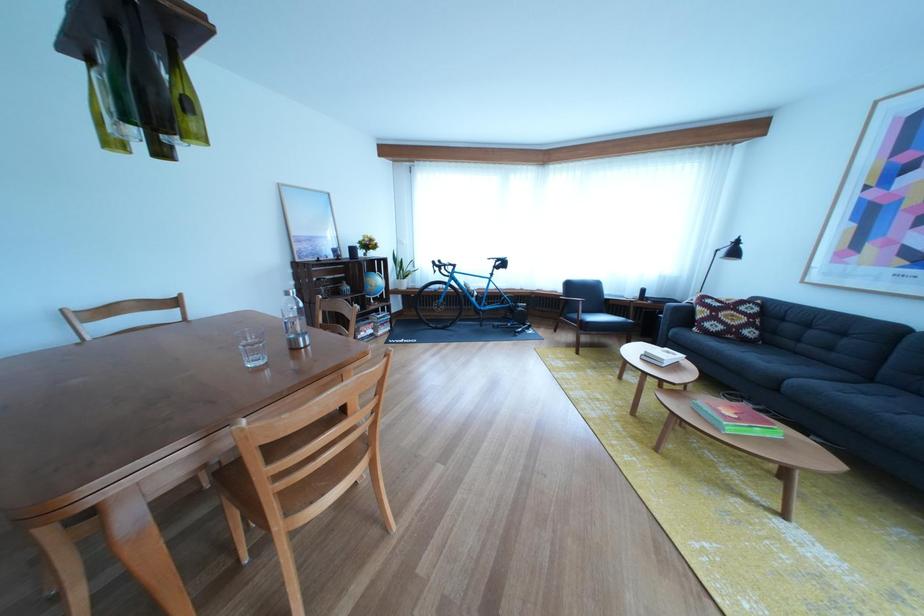
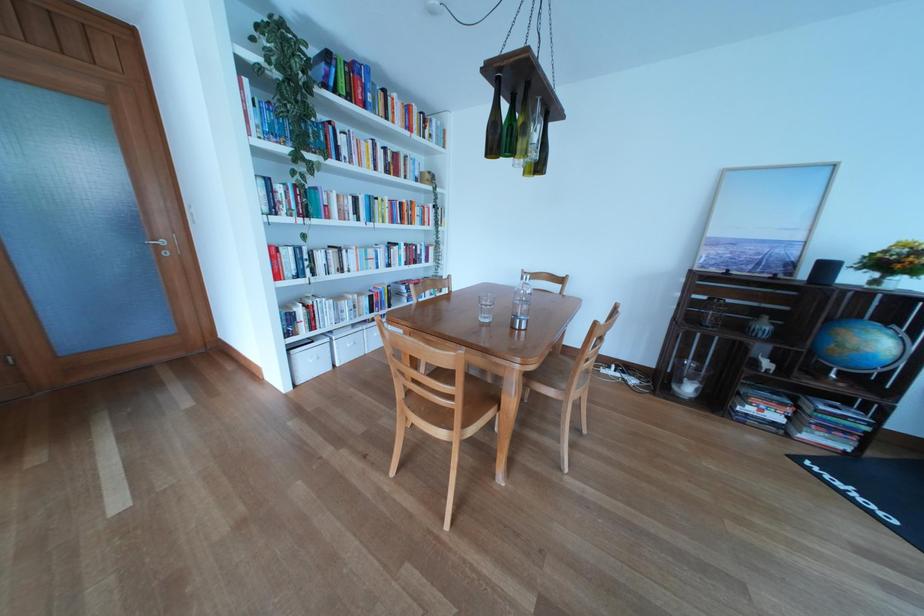
Question: I am providing you with two images of the same scene from different viewpoints. After the viewpoint changes to image2, which objects are now occluded?

Choices:
 (A) white storage box
 (B) clear glass
 (C) black speaker
 (D) none of these

Answer: (D)